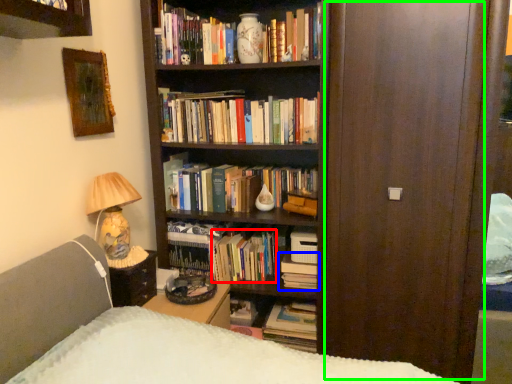
Question: Considering the real-world distances, which object is closest to book (highlighted by a red box)? book (highlighted by a blue box) or glass door (highlighted by a green box).

Choices:
 (A) book
 (B) glass door

Answer: (A)